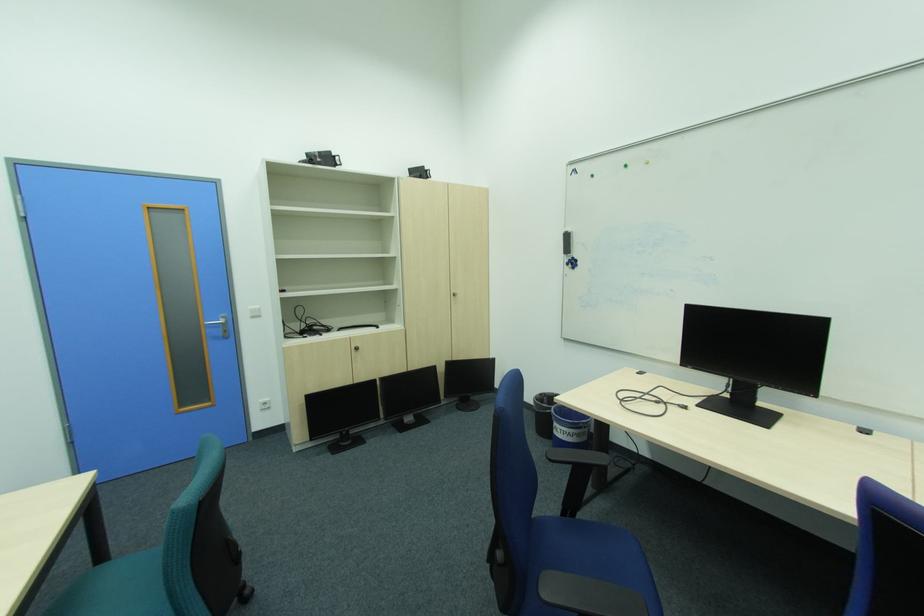
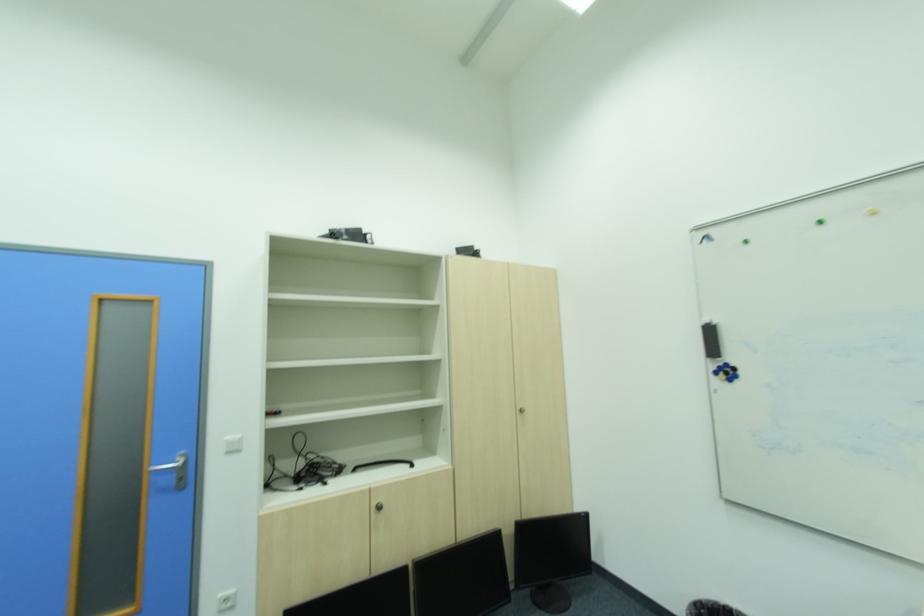
Locate, in the second image, the point that corresponds to point (273, 403) in the first image.

(234, 602)